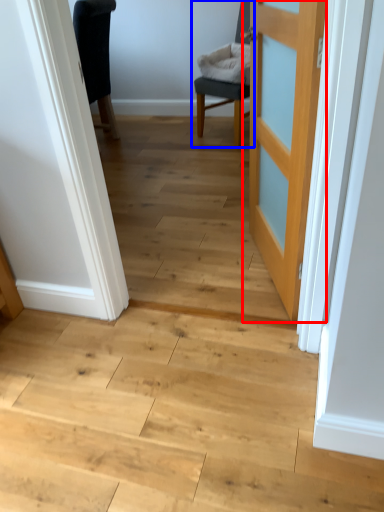
Question: Which object appears closest to the camera in this image, door (highlighted by a red box) or chair (highlighted by a blue box)?

Choices:
 (A) door
 (B) chair

Answer: (A)